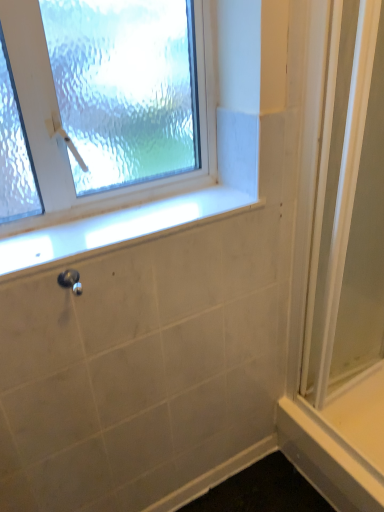
Find the location of `white marble window sill at center`. white marble window sill at center is located at coordinates (116, 228).

Image resolution: width=384 pixels, height=512 pixels. What do you see at coordinates (116, 228) in the screenshot?
I see `white marble window sill at center` at bounding box center [116, 228].

Identify the location of satin nickel shower at lower left. (70, 280).

Describe the element at coordinates (326, 461) in the screenshot. I see `white smooth ledge at lower right` at that location.

What do you see at coordinates (149, 193) in the screenshot? This screenshot has width=384, height=512. I see `clear glass window at upper left` at bounding box center [149, 193].

Find the location of `white marble window sill at center`. white marble window sill at center is located at coordinates (116, 228).

Does satin nickel shower at lower left have a greater height compared to white marble window sill at center?

Indeed, satin nickel shower at lower left has a greater height compared to white marble window sill at center.

Between satin nickel shower at lower left and white marble window sill at center, which one has smaller width?

satin nickel shower at lower left.

Is satin nickel shower at lower left looking in the opposite direction of white marble window sill at center?

No, satin nickel shower at lower left's orientation is not away from white marble window sill at center.

From a real-world perspective, which object rests below the other?

satin nickel shower at lower left.

Considering the sizes of objects clear glass screen door at right and clear glass window at upper left in the image provided, who is thinner, clear glass screen door at right or clear glass window at upper left?

clear glass screen door at right is thinner.

Which of these two, clear glass screen door at right or clear glass window at upper left, is smaller?

With smaller size is clear glass window at upper left.

Based on the photo, considering the positions of objects clear glass screen door at right and clear glass window at upper left in the image provided, who is more to the right, clear glass screen door at right or clear glass window at upper left?

clear glass screen door at right is more to the right.

From the image's perspective, does clear glass screen door at right appear higher than clear glass window at upper left?

No.

From the image's perspective, which object appears higher, clear glass screen door at right or satin nickel shower at lower left?

clear glass screen door at right appears higher in the image.

Are clear glass screen door at right and satin nickel shower at lower left beside each other?

No, clear glass screen door at right is not in contact with satin nickel shower at lower left.

Does clear glass screen door at right appear on the right side of satin nickel shower at lower left?

Yes.

The width and height of the screenshot is (384, 512). What are the coordinates of `shower on the left side of white smooth ledge at lower right` in the screenshot? It's located at (70, 280).

Which object is positioned more to the right, satin nickel shower at lower left or white smooth ledge at lower right?

From the viewer's perspective, white smooth ledge at lower right appears more on the right side.

Consider the image. From the image's perspective, is satin nickel shower at lower left above white smooth ledge at lower right?

Correct, satin nickel shower at lower left appears higher than white smooth ledge at lower right in the image.

Is white smooth ledge at lower right surrounded by satin nickel shower at lower left?

No.

Is white marble window sill at center to the left or to the right of white smooth ledge at lower right in the image?

Based on their positions, white marble window sill at center is located to the left of white smooth ledge at lower right.

Could you tell me if white marble window sill at center is facing white smooth ledge at lower right?

No, white marble window sill at center is not turned towards white smooth ledge at lower right.

From a real-world perspective, between white marble window sill at center and white smooth ledge at lower right, who is vertically lower?

From a 3D spatial view, white smooth ledge at lower right is below.

Considering the sizes of objects white marble window sill at center and white smooth ledge at lower right in the image provided, who is bigger, white marble window sill at center or white smooth ledge at lower right?

Bigger between the two is white smooth ledge at lower right.

Can you tell me how much white smooth ledge at lower right and white marble window sill at center differ in facing direction?

white smooth ledge at lower right and white marble window sill at center are facing 89.4 degrees away from each other.

From the image's perspective, is white smooth ledge at lower right located above white marble window sill at center?

No, from the image's perspective, white smooth ledge at lower right is not over white marble window sill at center.

At what (x,y) coordinates should I click in order to perform the action: click on window sill located above the white smooth ledge at lower right (from the image's perspective). Please return your answer as a coordinate pair (x, y). The width and height of the screenshot is (384, 512). Looking at the image, I should click on (116, 228).

Considering the relative sizes of white marble window sill at center and clear glass window at upper left in the image provided, is white marble window sill at center thinner than clear glass window at upper left?

No, white marble window sill at center is not thinner than clear glass window at upper left.

Is white marble window sill at center oriented towards clear glass window at upper left?

No, white marble window sill at center is not facing towards clear glass window at upper left.

In the scene shown: How different are the orientations of white marble window sill at center and clear glass window at upper left in degrees?

There is a 0.0812-degree angle between the facing directions of white marble window sill at center and clear glass window at upper left.

Is white marble window sill at center closer to camera compared to clear glass window at upper left?

No.

You are a GUI agent. You are given a task and a screenshot of the screen. Output one action in this format:
    pyautogui.click(x=<x>, y=<y>)
    Task: Click on the window sill above the satin nickel shower at lower left (from the image's perspective)
    The height and width of the screenshot is (512, 384).
    Given the screenshot: What is the action you would take?
    pyautogui.click(x=116, y=228)

At what (x,y) coordinates should I click in order to perform the action: click on screen door behind the clear glass window at upper left. Please return your answer as a coordinate pair (x, y). Looking at the image, I should click on (348, 208).

Looking at the image, which one is located further to satin nickel shower at lower left, white smooth ledge at lower right or white marble window sill at center?

white smooth ledge at lower right lies further to satin nickel shower at lower left than the other object.

From the image, which object appears to be nearer to satin nickel shower at lower left, white marble window sill at center or clear glass screen door at right?

The object closer to satin nickel shower at lower left is white marble window sill at center.

When comparing their distances from clear glass screen door at right, does clear glass window at upper left or satin nickel shower at lower left seem further?

Based on the image, satin nickel shower at lower left appears to be further to clear glass screen door at right.

Estimate the real-world distances between objects in this image. Which object is further from white marble window sill at center, clear glass window at upper left or clear glass screen door at right?

clear glass screen door at right is positioned further to the anchor white marble window sill at center.

Estimate the real-world distances between objects in this image. Which object is closer to white smooth ledge at lower right, satin nickel shower at lower left or clear glass window at upper left?

clear glass window at upper left is positioned closer to the anchor white smooth ledge at lower right.

Looking at this image, looking at the image, which one is located further to satin nickel shower at lower left, white marble window sill at center or clear glass window at upper left?

clear glass window at upper left.

Estimate the real-world distances between objects in this image. Which object is closer to clear glass window at upper left, satin nickel shower at lower left or clear glass screen door at right?

satin nickel shower at lower left lies closer to clear glass window at upper left than the other object.

Which object lies nearer to the anchor point satin nickel shower at lower left, clear glass screen door at right or white smooth ledge at lower right?

→ Among the two, clear glass screen door at right is located nearer to satin nickel shower at lower left.

Locate an element on the screen. The height and width of the screenshot is (512, 384). window sill between clear glass window at upper left and satin nickel shower at lower left in the vertical direction is located at coordinates (116, 228).

Identify the location of window sill that lies between clear glass window at upper left and white smooth ledge at lower right from top to bottom. (116, 228).

You are a GUI agent. You are given a task and a screenshot of the screen. Output one action in this format:
    pyautogui.click(x=<x>, y=<y>)
    Task: Click on the shower that lies between clear glass window at upper left and white smooth ledge at lower right from top to bottom
    This screenshot has width=384, height=512.
    Given the screenshot: What is the action you would take?
    pyautogui.click(x=70, y=280)

Locate an element on the screen. This screenshot has width=384, height=512. window sill located between satin nickel shower at lower left and clear glass screen door at right in the left-right direction is located at coordinates (116, 228).